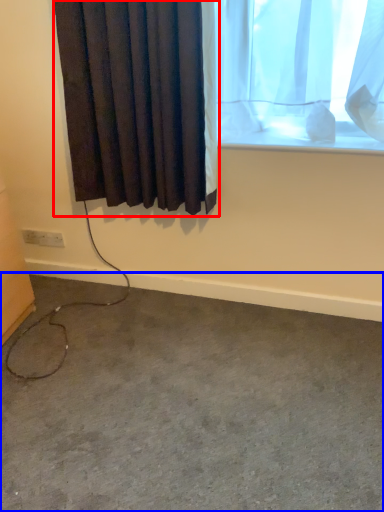
Question: Which of the following is the farthest to the observer, curtain (highlighted by a red box) or concrete (highlighted by a blue box)?

Choices:
 (A) curtain
 (B) concrete

Answer: (A)